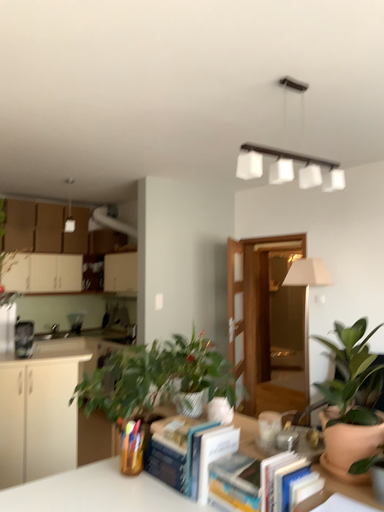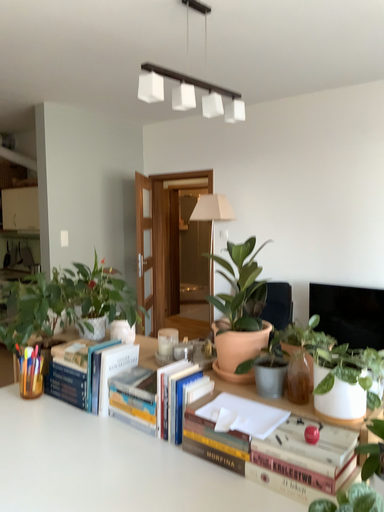
Question: Which way did the camera rotate in the video?

Choices:
 (A) rotated right
 (B) rotated left

Answer: (A)